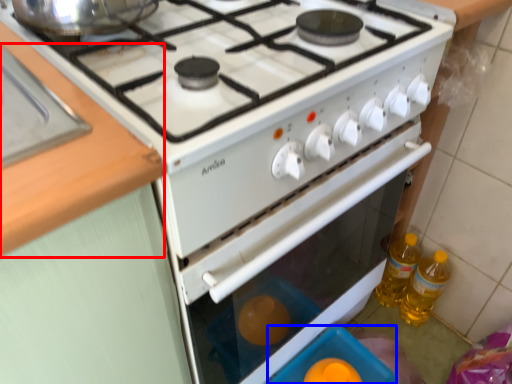
Question: Which object appears closest to the camera in this image, counter top (highlighted by a red box) or appliance (highlighted by a blue box)?

Choices:
 (A) counter top
 (B) appliance

Answer: (A)